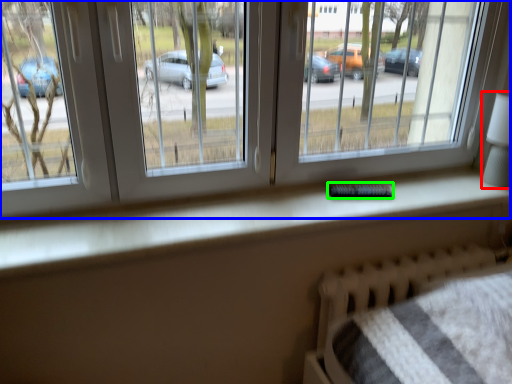
Question: Based on their relative distances, which object is nearer to table lamp (highlighted by a red box)? Choose from window (highlighted by a blue box) and remote (highlighted by a green box).

Choices:
 (A) window
 (B) remote

Answer: (A)